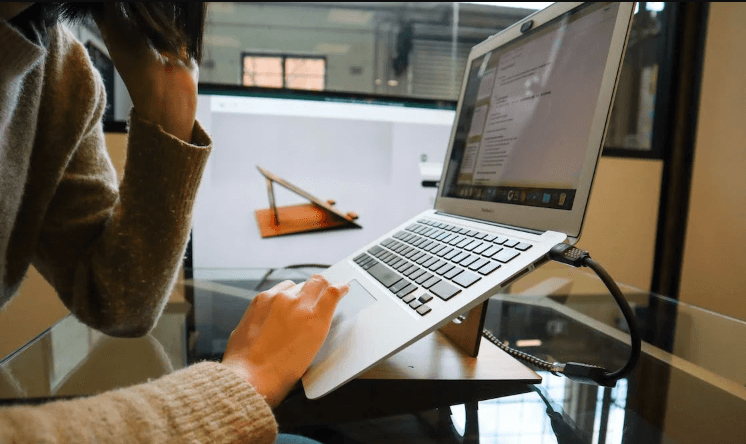
Identify the location of video screen. (329, 186).